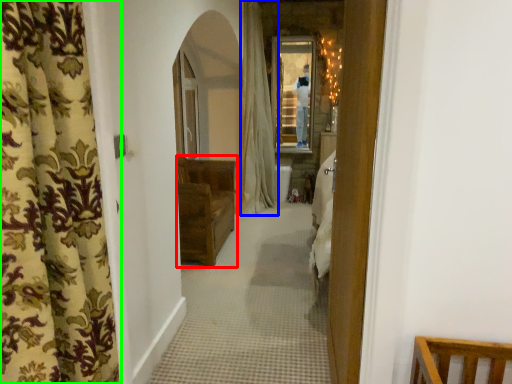
Question: Which is nearer to the furniture (highlighted by a red box)? curtain (highlighted by a blue box) or curtain (highlighted by a green box).

Choices:
 (A) curtain
 (B) curtain

Answer: (A)